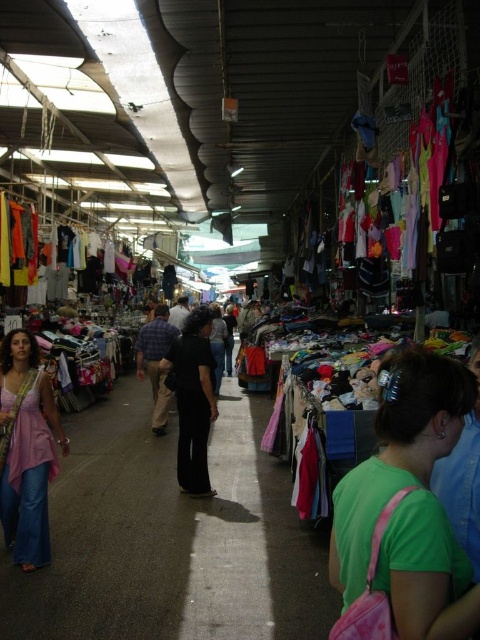
Measure the distance from green fabric bag at lower right to matte pink dress at left.

green fabric bag at lower right and matte pink dress at left are 10.66 feet apart from each other.

Is point (349, 477) farther from viewer compared to point (44, 440)?

No, it is in front of (44, 440).

Locate an element on the screen. This screenshot has width=480, height=640. green fabric bag at lower right is located at coordinates (399, 548).

Between black matte pants at center and matte black shirt at center, which one appears on the right side from the viewer's perspective?

Positioned to the right is matte black shirt at center.

Identify the location of black matte pants at center. The height and width of the screenshot is (640, 480). (192, 408).

Which is in front, point (212, 396) or point (215, 332)?

Point (212, 396) is more forward.

You are a GUI agent. You are given a task and a screenshot of the screen. Output one action in this format:
    pyautogui.click(x=<x>, y=<y>)
    Task: Click on the black matte pants at center
    
    Given the screenshot: What is the action you would take?
    pyautogui.click(x=192, y=408)

Is point (193, 416) in front of point (467, 417)?

That is False.

In the scene shown: Between black matte pants at center and green matte shirt at lower right, which one is positioned higher?

green matte shirt at lower right is above.

This screenshot has width=480, height=640. What are the coordinates of `black matte pants at center` in the screenshot? It's located at (192, 408).